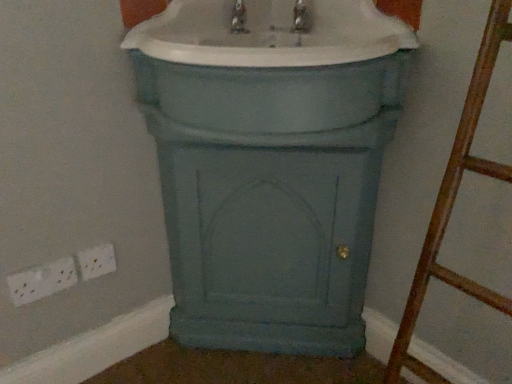
Question: Is matte blue cabinet at center located outside matte blue cabinet at center?

Choices:
 (A) no
 (B) yes

Answer: (B)

Question: From a real-world perspective, is matte blue cabinet at center over matte blue cabinet at center?

Choices:
 (A) yes
 (B) no

Answer: (B)

Question: Considering the relative positions of matte blue cabinet at center and matte blue cabinet at center in the image provided, is matte blue cabinet at center behind matte blue cabinet at center?

Choices:
 (A) no
 (B) yes

Answer: (B)

Question: Considering the relative sizes of matte blue cabinet at center and matte blue cabinet at center in the image provided, is matte blue cabinet at center wider than matte blue cabinet at center?

Choices:
 (A) no
 (B) yes

Answer: (A)

Question: Could you tell me if matte blue cabinet at center is facing matte blue cabinet at center?

Choices:
 (A) yes
 (B) no

Answer: (B)

Question: Could matte blue cabinet at center be considered to be inside matte blue cabinet at center?

Choices:
 (A) yes
 (B) no

Answer: (A)

Question: From the image's perspective, is white plastic electric outlet at lower left, the first electric outlet positioned from the right, below matte blue cabinet at center?

Choices:
 (A) yes
 (B) no

Answer: (A)

Question: Can you confirm if white plastic electric outlet at lower left, the first electric outlet positioned from the right, is thinner than matte blue cabinet at center?

Choices:
 (A) no
 (B) yes

Answer: (B)

Question: Does white plastic electric outlet at lower left, the 2th electric outlet when ordered from left to right, have a greater height compared to matte blue cabinet at center?

Choices:
 (A) yes
 (B) no

Answer: (B)

Question: Is white plastic electric outlet at lower left, the 2th electric outlet when ordered from left to right, smaller than matte blue cabinet at center?

Choices:
 (A) yes
 (B) no

Answer: (A)

Question: From the image's perspective, is white plastic electric outlet at lower left, the first electric outlet positioned from the right, above matte blue cabinet at center?

Choices:
 (A) no
 (B) yes

Answer: (A)

Question: Is white plastic electric outlet at lower left, the 2th electric outlet when ordered from left to right, shorter than matte blue cabinet at center?

Choices:
 (A) no
 (B) yes

Answer: (B)

Question: From a real-world perspective, is white plastic socket at lower left, which ranks as the 2th electric outlet in right-to-left order, located higher than matte blue cabinet at center?

Choices:
 (A) yes
 (B) no

Answer: (B)